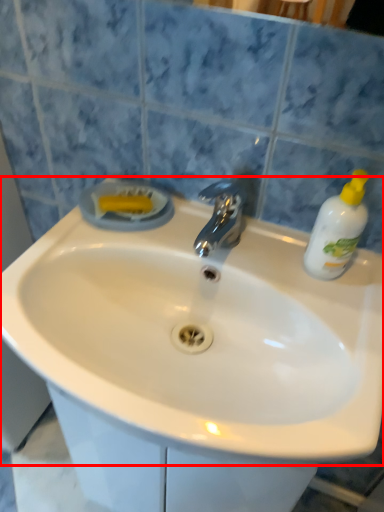
Question: In this image, where is sink (annotated by the red box) located relative to cleaning product?

Choices:
 (A) left
 (B) right

Answer: (A)